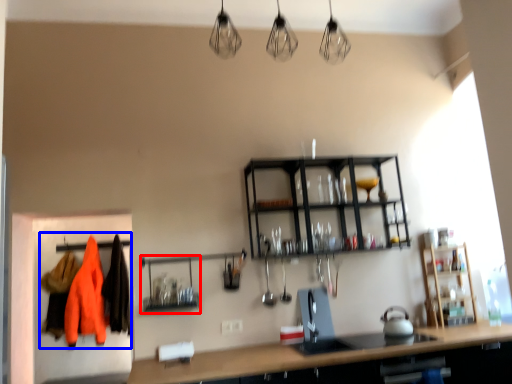
Question: Which point is closer to the camera, shelf (highlighted by a red box) or clothing (highlighted by a blue box)?

Choices:
 (A) shelf
 (B) clothing

Answer: (A)